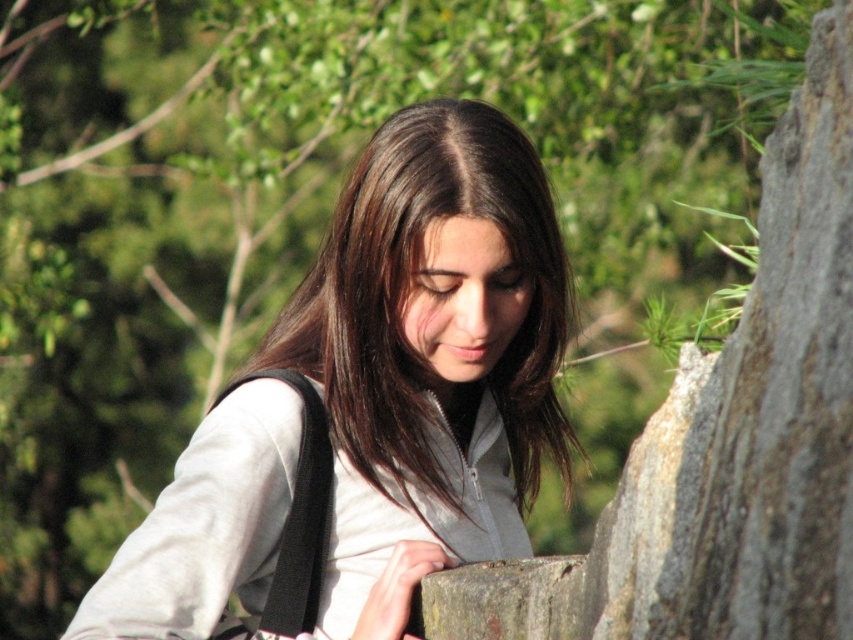
Question: Observing the image, what is the correct spatial positioning of white matte jacket at center in reference to gray rough stone at center?

Choices:
 (A) below
 (B) above

Answer: (B)

Question: Which point appears closest to the camera in this image?

Choices:
 (A) (822, 330)
 (B) (369, 493)

Answer: (A)

Question: In this image, where is white matte jacket at center located relative to black fabric shoulder bag at lower left?

Choices:
 (A) above
 (B) below

Answer: (A)

Question: Based on their relative distances, which object is farther from the black fabric shoulder bag at lower left?

Choices:
 (A) white matte jacket at center
 (B) gray rough stone at center

Answer: (B)

Question: Is gray rough stone at center further to the viewer compared to black fabric shoulder bag at lower left?

Choices:
 (A) yes
 (B) no

Answer: (B)

Question: Among these points, which one is nearest to the camera?

Choices:
 (A) (323, 544)
 (B) (389, 253)

Answer: (B)